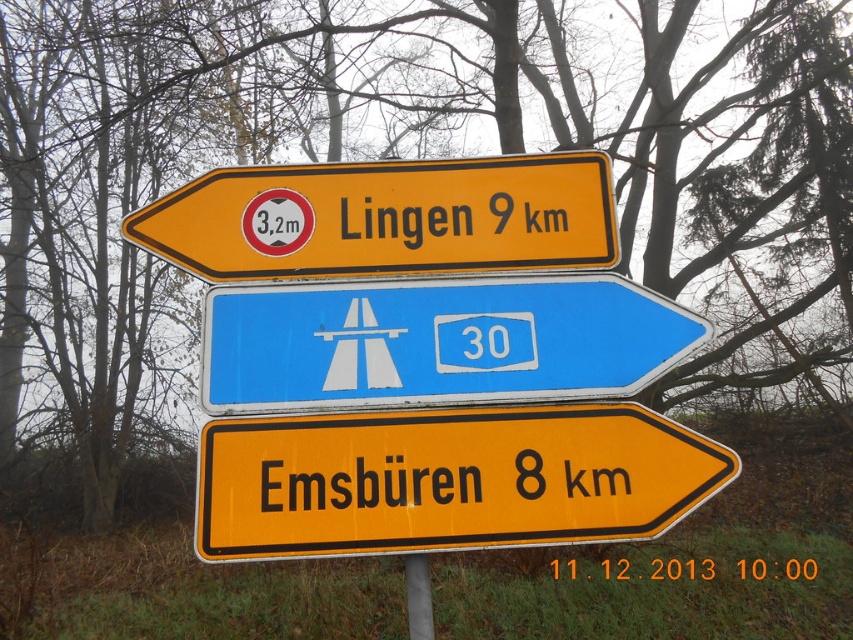
You are a truck driver who needs to know the height restriction for the road ahead. You see a yellow plastic sign at lower center and a blue plastic road sign at center. Which sign should you look at to find the height limit?

The red circular sign with a white border and a black silhouette of a car indicating a height restriction of 3.2 meters is on the yellow plastic sign at lower center, so you should look at the yellow plastic sign at lower center.

You are driving a truck with a height of 3.3 meters and need to know if you can pass under the road signs. The blue plastic road sign at center and yellow plastic sign at upper center are part of the structure. Can you safely pass under them?

The red circular sign within the yellow plastic sign at upper center indicates a height restriction of 3.2 meters. Since your truck is 3.3 meters tall, it exceeds the limit, so you cannot safely pass under the road signs.